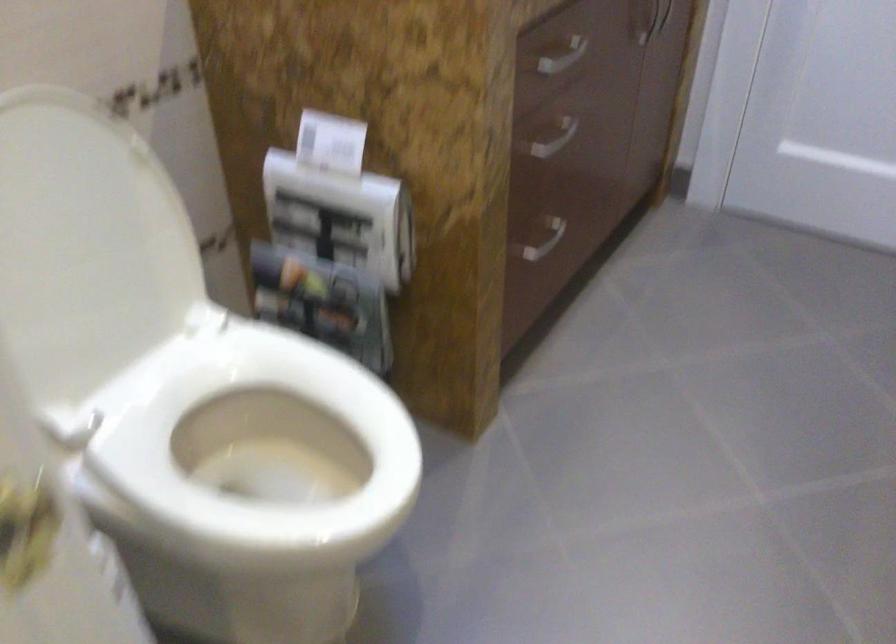
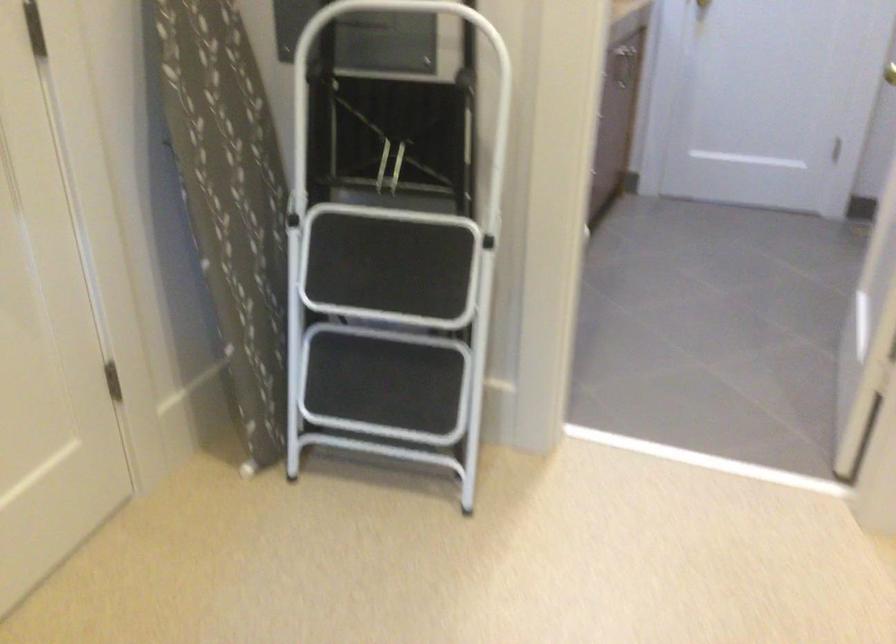
Question: I am providing you with two images of the same scene from different viewpoints. Please identify which objects are invisible in image2.

Choices:
 (A) white stool handle
 (B) red price tag
 (C) patterned ironing board
 (D) silver drawer handle

Answer: (D)